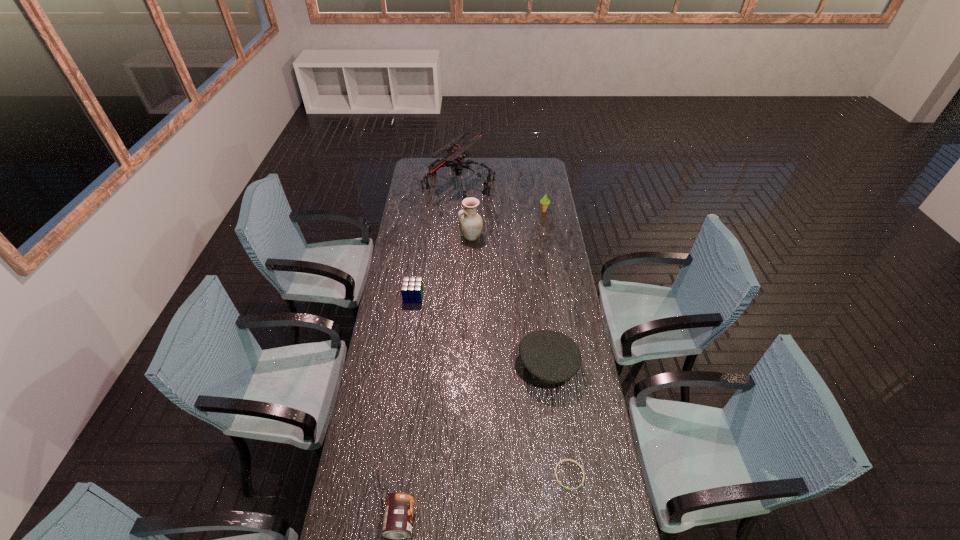
You are a GUI agent. You are given a task and a screenshot of the screen. Output one action in this format:
    pyautogui.click(x=<x>, y=<y>)
    Task: Click on the vacant point located on the front of the farthest object
    Image resolution: width=960 pixels, height=540 pixels.
    Given the screenshot: What is the action you would take?
    pyautogui.click(x=456, y=228)

Image resolution: width=960 pixels, height=540 pixels. Identify the location of free space located 0.140m on the back of the pottery. (471, 214).

Where is `vacant space located 0.060m on the front of the icecream`? This screenshot has height=540, width=960. vacant space located 0.060m on the front of the icecream is located at coordinates (545, 221).

Locate an element on the screen. The width and height of the screenshot is (960, 540). vacant space located on the front-facing side of the beret is located at coordinates (469, 366).

The image size is (960, 540). Identify the location of vacant area situated on the front-facing side of the beret. (417, 366).

What are the coordinates of `free point located 0.080m on the front-facing side of the beret` in the screenshot? It's located at (494, 366).

Image resolution: width=960 pixels, height=540 pixels. Find the location of `vacant space located on the back of the fourth farthest object`. vacant space located on the back of the fourth farthest object is located at coordinates (420, 246).

Locate an element on the screen. The width and height of the screenshot is (960, 540). vacant space located 0.080m on the front label of the nearest object is located at coordinates (441, 521).

Where is `vacant area situated on the surface of the sixth farthest object showing star-shaped elements`? This screenshot has height=540, width=960. vacant area situated on the surface of the sixth farthest object showing star-shaped elements is located at coordinates tap(576, 524).

Locate an element on the screen. object located at the far edge is located at coordinates (457, 153).